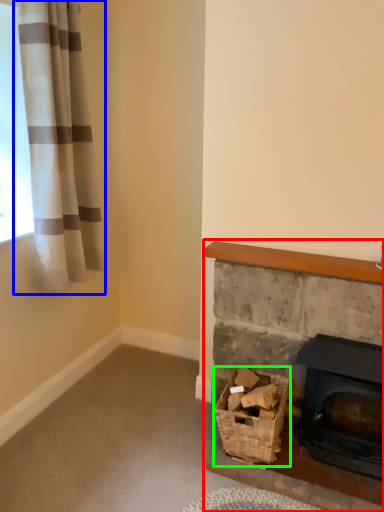
Question: Which is nearer to the fireplace (highlighted by a red box)? curtain (highlighted by a blue box) or basket (highlighted by a green box).

Choices:
 (A) curtain
 (B) basket

Answer: (B)